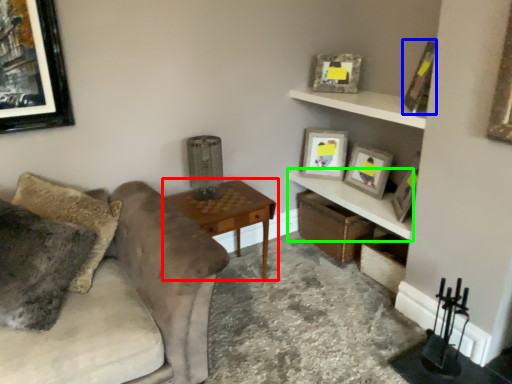
Question: Which object is the closest to the table (highlighted by a red box)? Choose among these: picture frame (highlighted by a blue box) or shelf (highlighted by a green box).

Choices:
 (A) picture frame
 (B) shelf

Answer: (B)